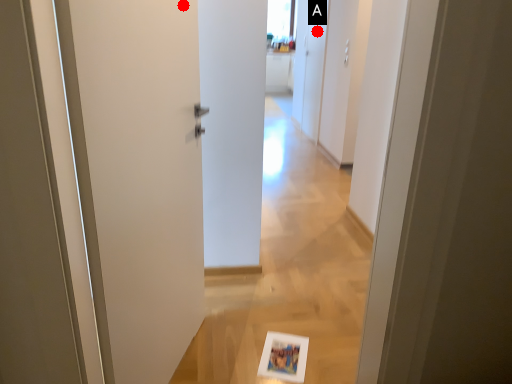
Question: Two points are circled on the image, labeled by A and B beside each circle. Which point is closer to the camera taking this photo?

Choices:
 (A) A is closer
 (B) B is closer

Answer: (B)